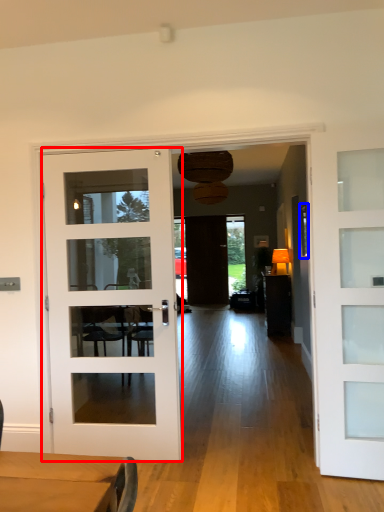
Question: Among these objects, which one is farthest to the camera, door (highlighted by a red box) or window (highlighted by a blue box)?

Choices:
 (A) door
 (B) window

Answer: (B)